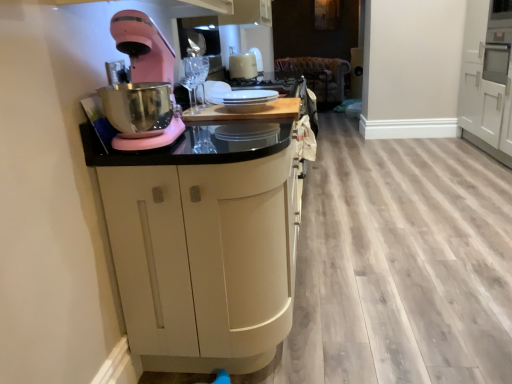
Question: From a real-world perspective, does white matte cabinet at right, which appears as the first cabinetry when viewed from the back, stand above pink matte stand mixer at left?

Choices:
 (A) no
 (B) yes

Answer: (A)

Question: Is white matte cabinet at right, which appears as the first cabinetry when viewed from the back, shorter than pink matte stand mixer at left?

Choices:
 (A) yes
 (B) no

Answer: (B)

Question: Is white matte cabinet at right, placed as the second cabinetry when sorted from front to back, aimed at pink matte stand mixer at left?

Choices:
 (A) yes
 (B) no

Answer: (B)

Question: Is white matte cabinet at right, arranged as the second cabinetry when viewed from the left, with pink matte stand mixer at left?

Choices:
 (A) no
 (B) yes

Answer: (A)

Question: Is white matte cabinet at right, arranged as the second cabinetry when viewed from the left, to the left of pink matte stand mixer at left from the viewer's perspective?

Choices:
 (A) no
 (B) yes

Answer: (A)

Question: Considering the relative sizes of white matte cabinet at right, placed as the second cabinetry when sorted from front to back, and pink matte stand mixer at left in the image provided, is white matte cabinet at right, placed as the second cabinetry when sorted from front to back, smaller than pink matte stand mixer at left?

Choices:
 (A) no
 (B) yes

Answer: (A)

Question: Considering the relative sizes of matte black cabinet at center, which is the 1th cabinetry in left-to-right order, and white matte cabinet at right, placed as the second cabinetry when sorted from front to back, in the image provided, is matte black cabinet at center, which is the 1th cabinetry in left-to-right order, shorter than white matte cabinet at right, placed as the second cabinetry when sorted from front to back,?

Choices:
 (A) yes
 (B) no

Answer: (A)

Question: Is matte black cabinet at center, the second cabinetry positioned from the right, wider than white matte cabinet at right, arranged as the second cabinetry when viewed from the left?

Choices:
 (A) yes
 (B) no

Answer: (B)

Question: Can you confirm if matte black cabinet at center, which is the 1th cabinetry in left-to-right order, is thinner than white matte cabinet at right, which appears as the first cabinetry when viewed from the back?

Choices:
 (A) yes
 (B) no

Answer: (A)

Question: From the image's perspective, would you say matte black cabinet at center, the 1th cabinetry when ordered from front to back, is positioned over white matte cabinet at right, marked as the first cabinetry in a right-to-left arrangement?

Choices:
 (A) no
 (B) yes

Answer: (A)

Question: Can you see matte black cabinet at center, the 1th cabinetry when ordered from front to back, touching white matte cabinet at right, arranged as the second cabinetry when viewed from the left?

Choices:
 (A) yes
 (B) no

Answer: (B)

Question: Considering the relative sizes of matte black cabinet at center, which is the second cabinetry in back-to-front order, and white matte cabinet at right, which appears as the first cabinetry when viewed from the back, in the image provided, is matte black cabinet at center, which is the second cabinetry in back-to-front order, taller than white matte cabinet at right, which appears as the first cabinetry when viewed from the back,?

Choices:
 (A) no
 (B) yes

Answer: (A)

Question: Can you confirm if matte black cabinet at center, which is the 1th cabinetry in left-to-right order, is taller than white glossy plates at center?

Choices:
 (A) no
 (B) yes

Answer: (B)